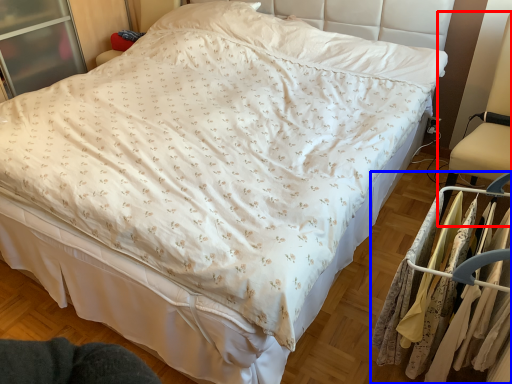
Question: Which of the following is the farthest to the observer, swivel chair (highlighted by a red box) or closet (highlighted by a blue box)?

Choices:
 (A) swivel chair
 (B) closet

Answer: (A)